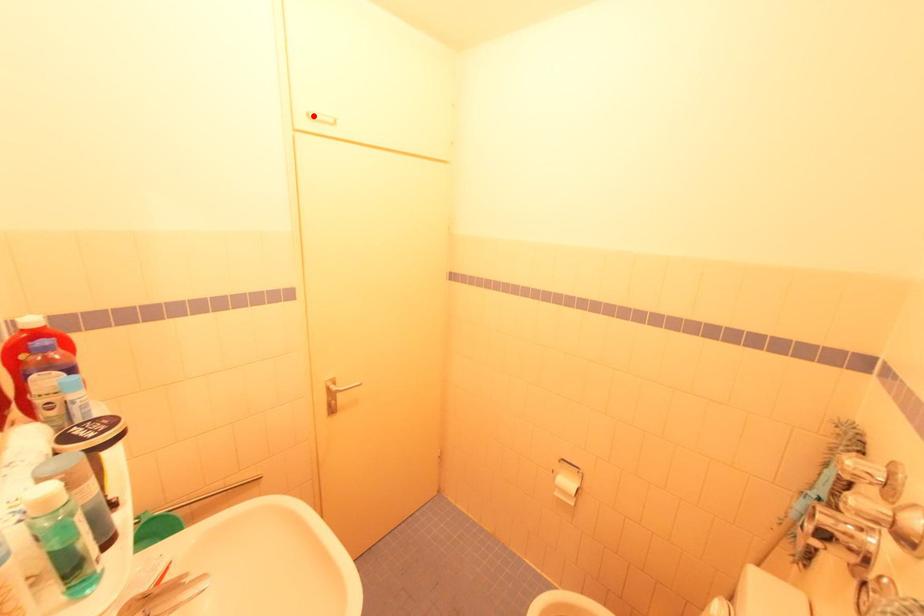
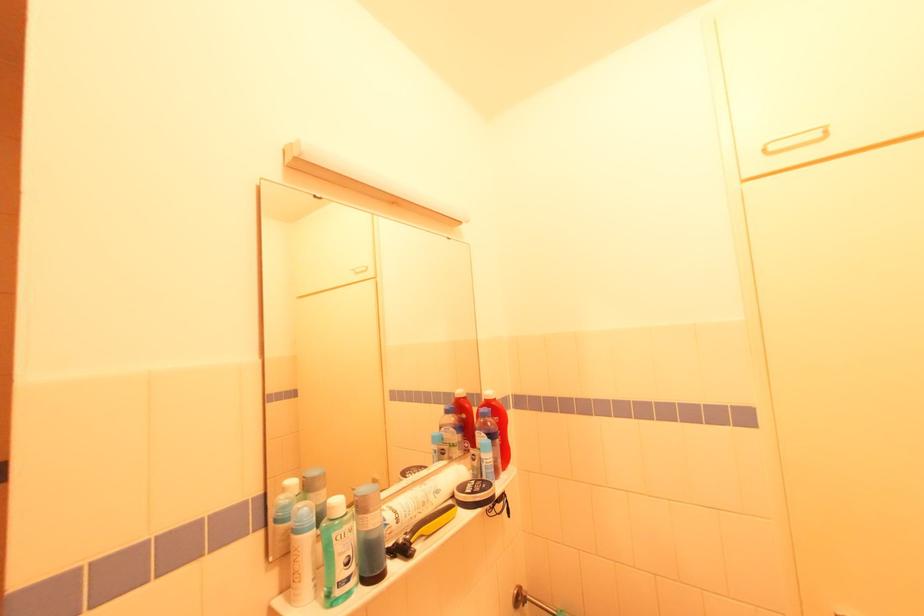
Where in the second image is the point corresponding to the highlighted location from the first image?

(773, 148)